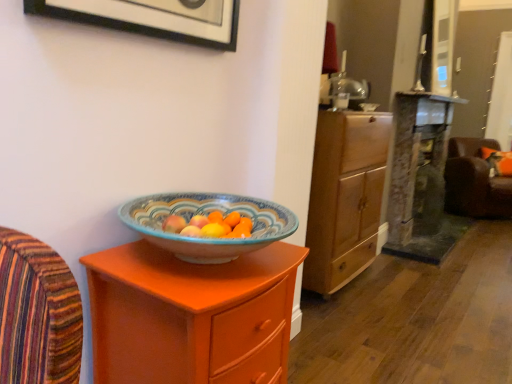
Question: Does matte black picture frame at upper left lie in front of orange fabric pillow at right?

Choices:
 (A) no
 (B) yes

Answer: (B)

Question: Is matte black picture frame at upper left smaller than orange fabric pillow at right?

Choices:
 (A) no
 (B) yes

Answer: (B)

Question: Can you confirm if matte black picture frame at upper left is shorter than orange fabric pillow at right?

Choices:
 (A) no
 (B) yes

Answer: (B)

Question: Is matte black picture frame at upper left far away from orange fabric pillow at right?

Choices:
 (A) yes
 (B) no

Answer: (A)

Question: Considering the relative positions of matte black picture frame at upper left and orange fabric pillow at right in the image provided, is matte black picture frame at upper left to the right of orange fabric pillow at right from the viewer's perspective?

Choices:
 (A) no
 (B) yes

Answer: (A)

Question: Is the position of matte black picture frame at upper left more distant than that of orange fabric pillow at right?

Choices:
 (A) yes
 (B) no

Answer: (B)

Question: Can you confirm if orange fabric pillow at right is smaller than brown leather swivel chair at right?

Choices:
 (A) yes
 (B) no

Answer: (A)

Question: Is orange fabric pillow at right thinner than brown leather swivel chair at right?

Choices:
 (A) yes
 (B) no

Answer: (A)

Question: Would you say brown leather swivel chair at right is part of orange fabric pillow at right's contents?

Choices:
 (A) yes
 (B) no

Answer: (B)

Question: Is orange fabric pillow at right positioned behind brown leather swivel chair at right?

Choices:
 (A) yes
 (B) no

Answer: (A)

Question: Is orange fabric pillow at right far from brown leather swivel chair at right?

Choices:
 (A) yes
 (B) no

Answer: (B)

Question: Considering the relative positions of orange fabric pillow at right and brown leather swivel chair at right in the image provided, is orange fabric pillow at right to the left of brown leather swivel chair at right from the viewer's perspective?

Choices:
 (A) yes
 (B) no

Answer: (B)

Question: Is matte orange cabinet at center positioned beyond the bounds of brown leather swivel chair at right?

Choices:
 (A) yes
 (B) no

Answer: (A)